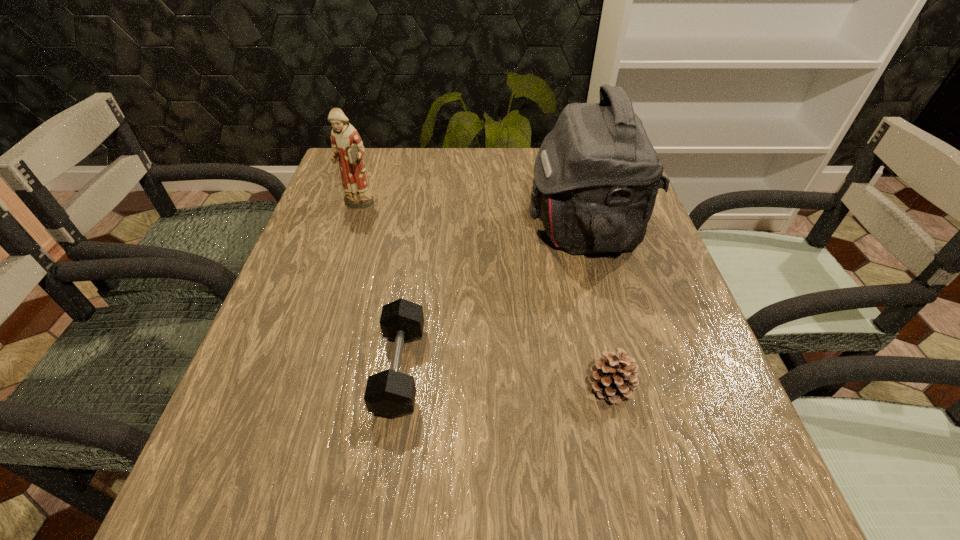
The width and height of the screenshot is (960, 540). I want to click on the tallest object, so click(596, 176).

The height and width of the screenshot is (540, 960). I want to click on the leftmost object, so pyautogui.click(x=347, y=147).

The height and width of the screenshot is (540, 960). Identify the location of figurine. (347, 147).

At what (x,y) coordinates should I click in order to perform the action: click on pinecone. Please return your answer as a coordinate pair (x, y). Looking at the image, I should click on (613, 378).

You are a GUI agent. You are given a task and a screenshot of the screen. Output one action in this format:
    pyautogui.click(x=<x>, y=<y>)
    Task: Click on the third object from right to left
    This screenshot has width=960, height=540.
    Given the screenshot: What is the action you would take?
    pyautogui.click(x=390, y=393)

This screenshot has width=960, height=540. What are the coordinates of `vacant point located 0.180m on the open flap of the tallest object` in the screenshot? It's located at (451, 228).

Locate an element on the screen. This screenshot has width=960, height=540. vacant space positioned 0.180m on the open flap of the tallest object is located at coordinates (451, 228).

Find the location of `free space located 0.350m on the open flap of the tallest object`. free space located 0.350m on the open flap of the tallest object is located at coordinates (380, 228).

At what (x,y) coordinates should I click in order to perform the action: click on vacant space situated on the front-facing side of the figurine. Please return your answer as a coordinate pair (x, y). Looking at the image, I should click on (319, 323).

Identify the location of free region located on the left of the pinecone. This screenshot has width=960, height=540. (521, 388).